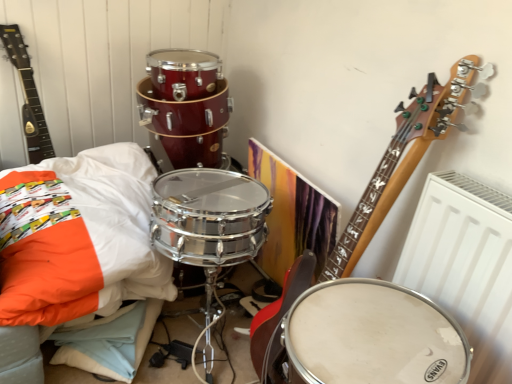
Question: Is white matte drum at center positioned with its back to white soft pillow at lower left?

Choices:
 (A) no
 (B) yes

Answer: (A)

Question: Is white matte drum at center directly adjacent to white soft pillow at lower left?

Choices:
 (A) no
 (B) yes

Answer: (A)

Question: Considering the relative sizes of white matte drum at center and white soft pillow at lower left in the image provided, is white matte drum at center taller than white soft pillow at lower left?

Choices:
 (A) no
 (B) yes

Answer: (A)

Question: From the image's perspective, is white matte drum at center located above white soft pillow at lower left?

Choices:
 (A) no
 (B) yes

Answer: (A)

Question: Does white matte drum at center come behind white soft pillow at lower left?

Choices:
 (A) yes
 (B) no

Answer: (B)

Question: Is point (39, 104) closer or farther from the camera than point (412, 365)?

Choices:
 (A) farther
 (B) closer

Answer: (A)

Question: In terms of size, does matte black guitar at upper left appear bigger or smaller than white matte drum at center?

Choices:
 (A) small
 (B) big

Answer: (A)

Question: From the image's perspective, is matte black guitar at upper left located above or below white matte drum at center?

Choices:
 (A) above
 (B) below

Answer: (A)

Question: In the image, is matte black guitar at upper left positioned in front of or behind white matte drum at center?

Choices:
 (A) front
 (B) behind

Answer: (B)

Question: Based on their sizes in the image, would you say white matte drum at center is bigger or smaller than white soft pillow at lower left?

Choices:
 (A) small
 (B) big

Answer: (A)

Question: Which is correct: white matte drum at center is inside white soft pillow at lower left, or outside of it?

Choices:
 (A) outside
 (B) inside

Answer: (A)

Question: In terms of height, does white matte drum at center look taller or shorter compared to white soft pillow at lower left?

Choices:
 (A) short
 (B) tall

Answer: (A)

Question: Does point (331, 340) appear closer or farther from the camera than point (132, 172)?

Choices:
 (A) closer
 (B) farther

Answer: (A)

Question: From the image's perspective, is white soft pillow at lower left above or below white matte drum at center?

Choices:
 (A) above
 (B) below

Answer: (A)

Question: Is white soft pillow at lower left inside or outside of white matte drum at center?

Choices:
 (A) outside
 (B) inside

Answer: (A)